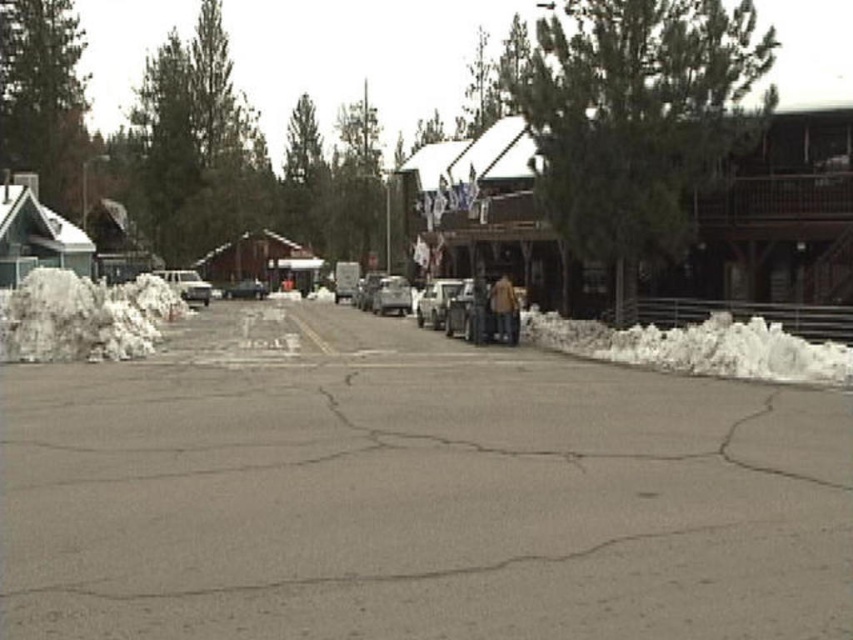
Does shiny silver sedan at center lie behind silver metallic car at center?

Yes, it is behind silver metallic car at center.

Is point (252, 296) positioned after point (380, 273)?

No, it is not.

Is point (252, 278) positioned before point (375, 272)?

No, it is behind (375, 272).

Locate an element on the screen. shiny silver sedan at center is located at coordinates (245, 289).

Identify the location of gray asphalt parking lot at center. Image resolution: width=853 pixels, height=640 pixels. (418, 497).

Find the location of `gray asphalt parking lot at center`. gray asphalt parking lot at center is located at coordinates (418, 497).

Between point (204, 12) and point (190, 289), which one is positioned in front?

Point (190, 289)

Between green matte tree at upper left and silver metallic van at center, which one has less height?

silver metallic van at center is shorter.

Does point (198, 81) lie behind point (189, 291)?

Yes, point (198, 81) is behind point (189, 291).

You are a GUI agent. You are given a task and a screenshot of the screen. Output one action in this format:
    pyautogui.click(x=<x>, y=<y>)
    Task: Click on the green matte tree at upper left
    The height and width of the screenshot is (640, 853).
    Given the screenshot: What is the action you would take?
    pyautogui.click(x=196, y=145)